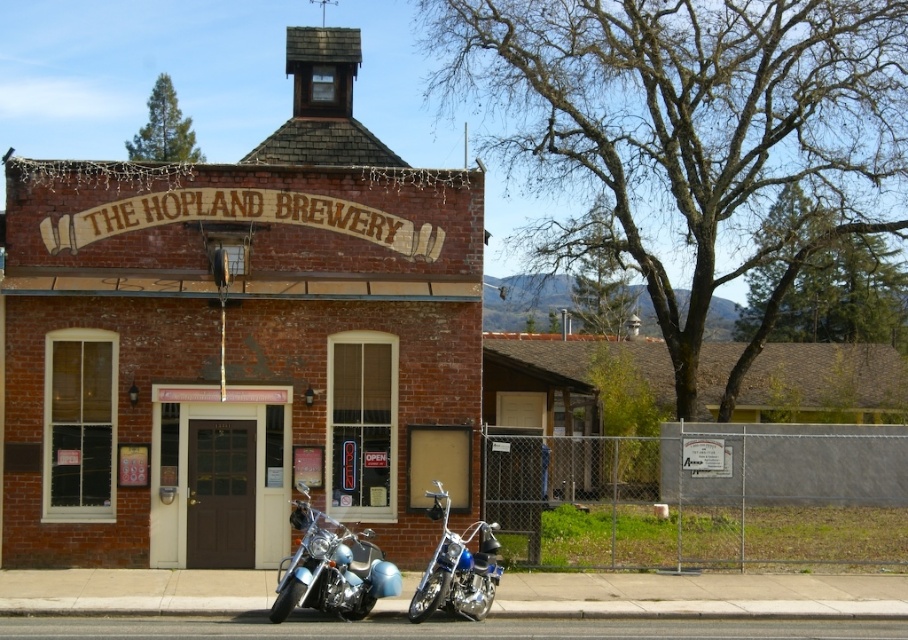
Question: Does shiny chrome motorcycle at lower center have a lesser width compared to shiny chrome motorcycle at center?

Choices:
 (A) no
 (B) yes

Answer: (A)

Question: Is shiny chrome motorcycle at lower center wider than shiny chrome motorcycle at center?

Choices:
 (A) yes
 (B) no

Answer: (A)

Question: Which of the following is the closest to the observer?

Choices:
 (A) (174, 436)
 (B) (429, 584)
 (C) (322, 593)

Answer: (C)

Question: Which point is closer to the camera taking this photo?

Choices:
 (A) (368, 593)
 (B) (467, 593)
 (C) (271, 458)

Answer: (A)

Question: Which object is the farthest from the shiny chrome motorcycle at center?

Choices:
 (A) shiny chrome motorcycle at lower center
 (B) brown wooden door at center

Answer: (B)

Question: Is brown wooden door at center to the right of shiny chrome motorcycle at center from the viewer's perspective?

Choices:
 (A) yes
 (B) no

Answer: (B)